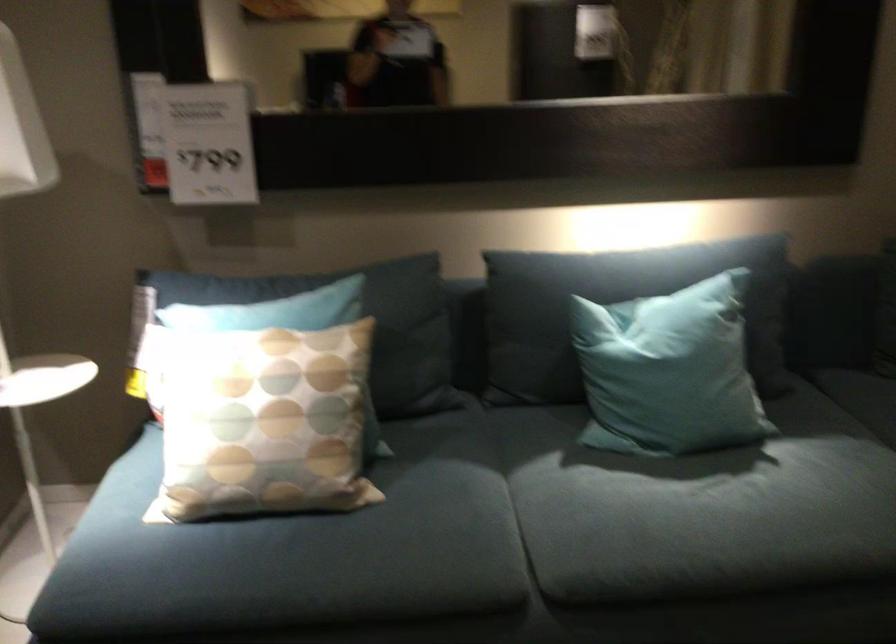
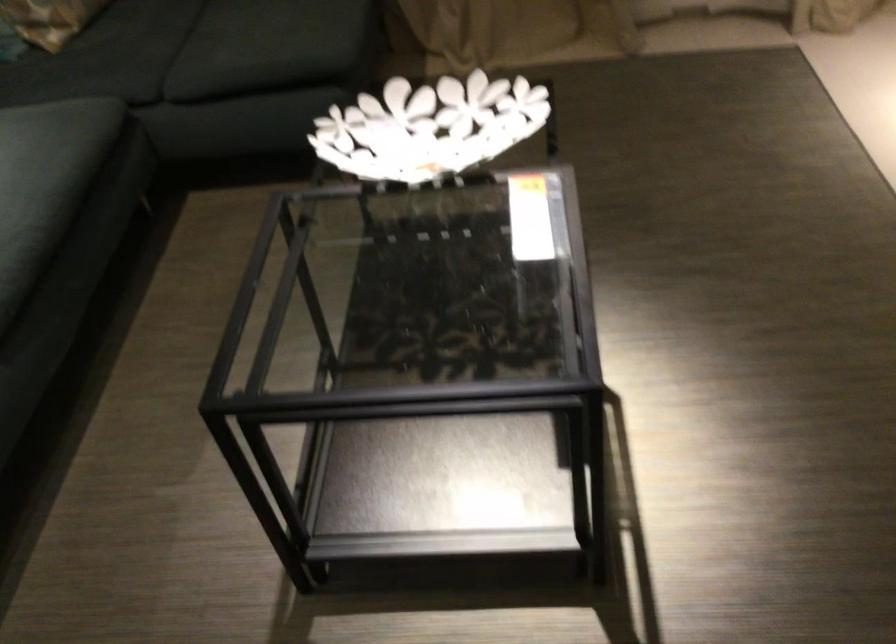
Based on the continuous images, in which direction is the camera rotating?

The rotation direction of the camera is right-down.